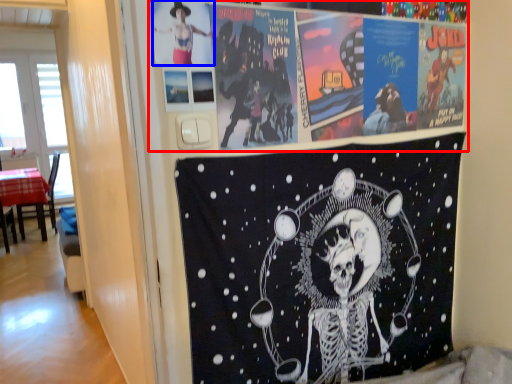
Question: Which object is closer to the camera taking this photo, poster (highlighted by a red box) or person (highlighted by a blue box)?

Choices:
 (A) poster
 (B) person

Answer: (B)